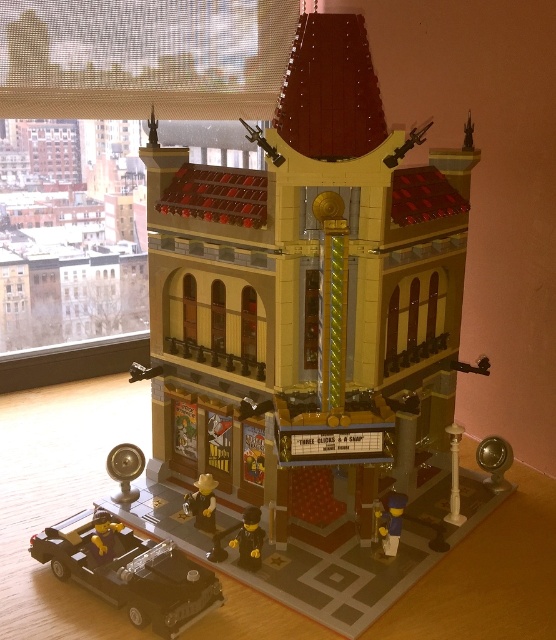
Question: Is brick-like minifigure at center behind yellow plastic car at lower left?

Choices:
 (A) yes
 (B) no

Answer: (A)

Question: Which point is closer to the camera?

Choices:
 (A) yellow plastic car at lower left
 (B) brick-like minifigure at center
 (C) matte yellow figure at center

Answer: (A)

Question: Which object appears farthest from the camera in this image?

Choices:
 (A) matte yellow figure at center
 (B) black plastic car at lower left
 (C) brick-like minifigure at center

Answer: (A)

Question: Where is black plastic car at lower left located in relation to blue plastic figure at lower right in the image?

Choices:
 (A) above
 (B) below

Answer: (B)

Question: Among these points, which one is farthest from the camera?

Choices:
 (A) (115, 554)
 (B) (211, 492)

Answer: (B)

Question: Is black plastic car at lower left above yellow plastic car at lower left?

Choices:
 (A) yes
 (B) no

Answer: (B)